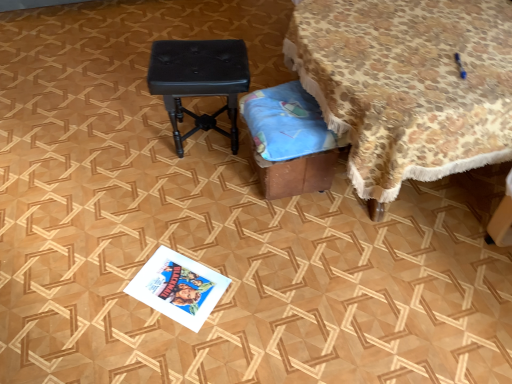
The height and width of the screenshot is (384, 512). I want to click on vacant area that is situated to the right of white glossy magazine at lower center, so click(249, 288).